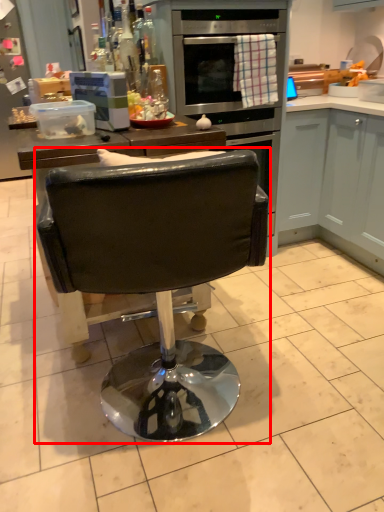
Question: From the image's perspective, considering the relative positions of chair (annotated by the red box) and cabinetry in the image provided, where is chair (annotated by the red box) located with respect to the staircase?

Choices:
 (A) above
 (B) below

Answer: (B)